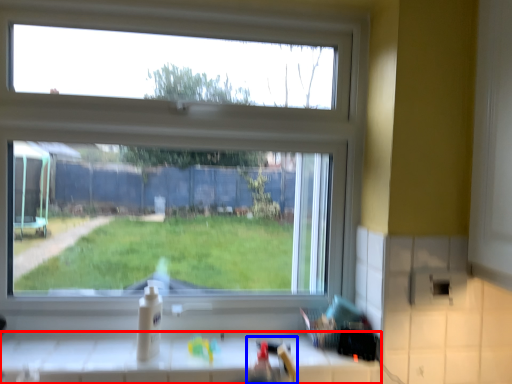
Question: Which object appears closest to the camera in this image, counter (highlighted by a red box) or sink (highlighted by a blue box)?

Choices:
 (A) counter
 (B) sink

Answer: (B)